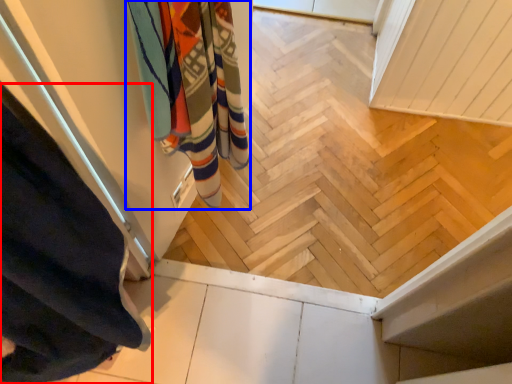
Question: Among these objects, which one is nearest to the camera, curtain (highlighted by a red box) or bath towel (highlighted by a blue box)?

Choices:
 (A) curtain
 (B) bath towel

Answer: (A)